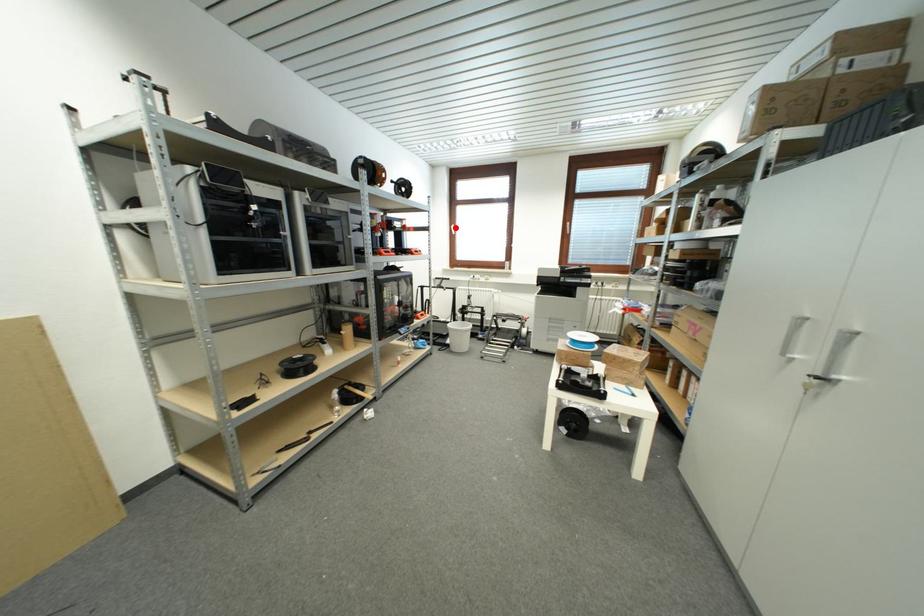
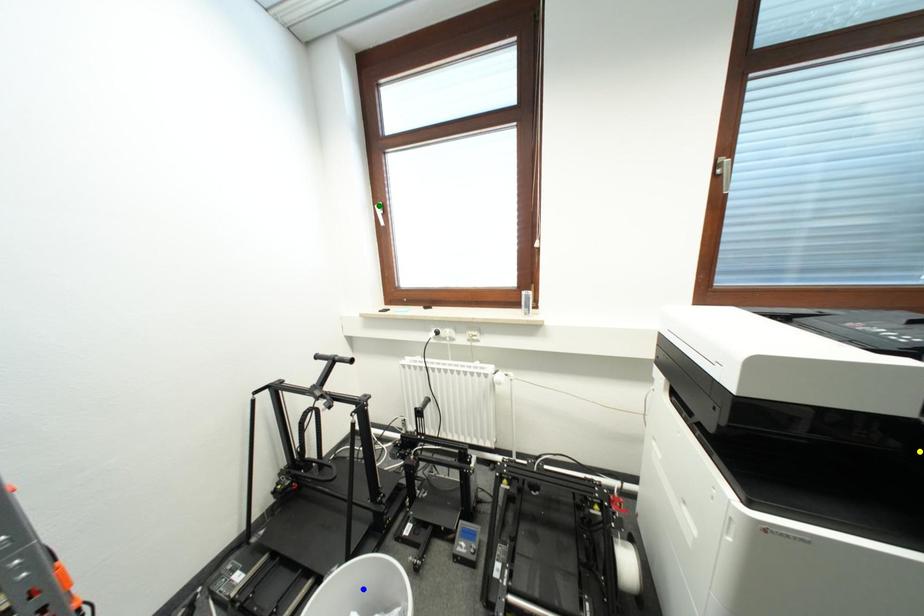
Question: I am providing you with two images of the same scene from different viewpoints. A red point is marked on the first image. You are given multiple points on the second image. Which point in image 2 is actually the same real-world point as the red point in image 1?

Choices:
 (A) blue point
 (B) yellow point
 (C) green point

Answer: (C)